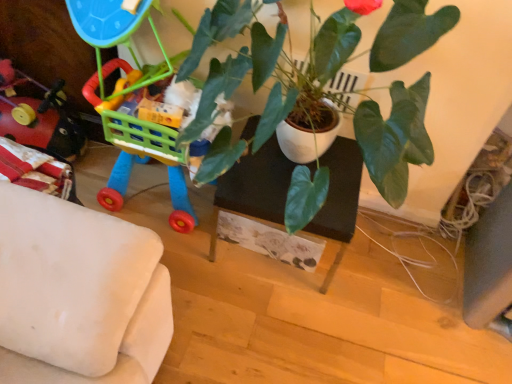
At what (x,y) coordinates should I click in order to perform the action: click on vacant space situated above black matte table at center (from a real-world perspective). Please return your answer as a coordinate pair (x, y). Looking at the image, I should click on (278, 163).